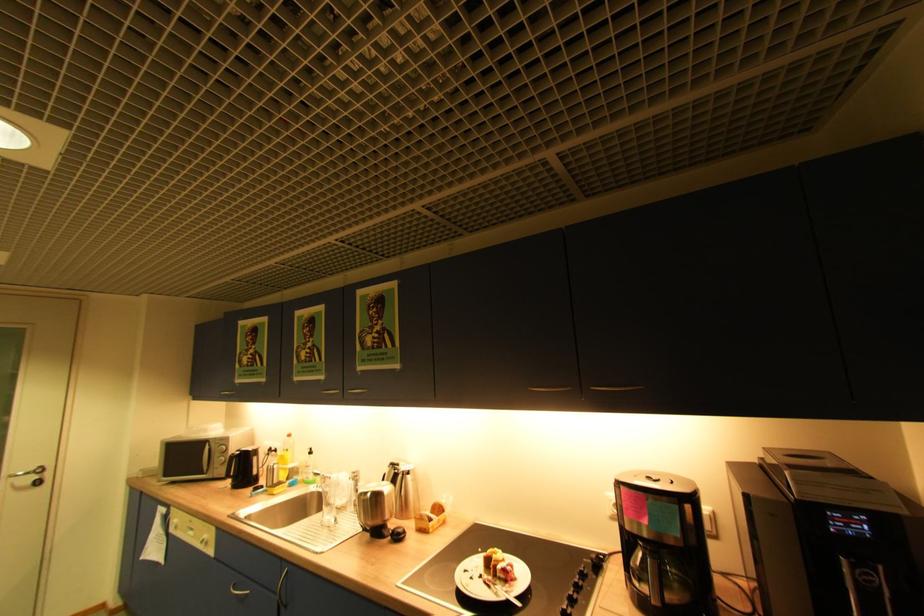
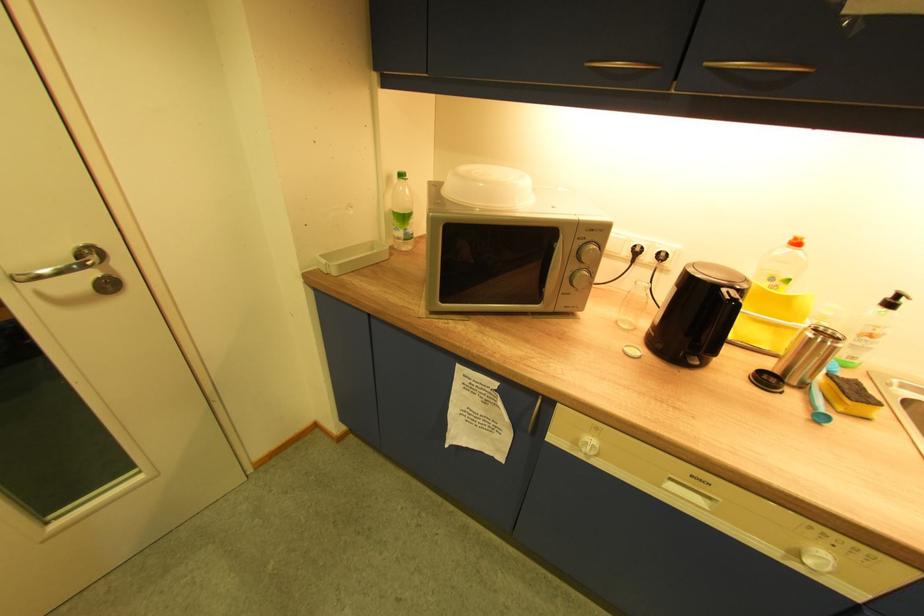
Question: I am providing you with two images of the same scene from different viewpoints. After the viewpoint changes to image2, which objects are now occluded?

Choices:
 (A) yellow kitchen sponge
 (B) soap dispenser pump
 (C) orange bottle cap
 (D) none of these

Answer: (D)